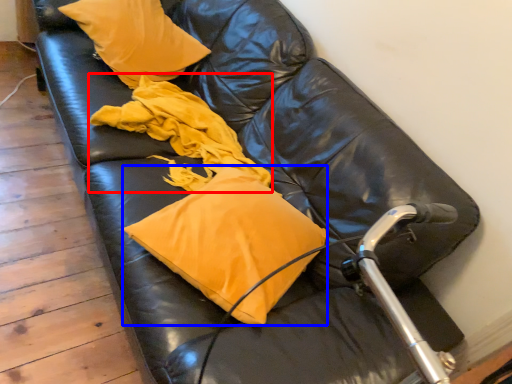
Question: Among these objects, which one is farthest to the camera, material (highlighted by a red box) or pillow (highlighted by a blue box)?

Choices:
 (A) material
 (B) pillow

Answer: (A)